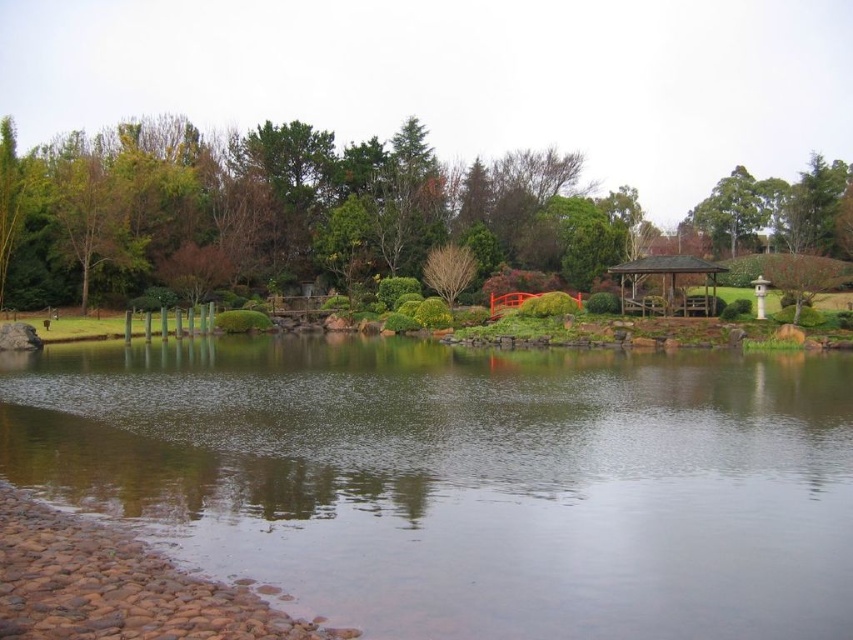
Does clear water at center lie in front of bare wood tree at center?

Yes.

Does clear water at center appear under bare wood tree at center?

Indeed, clear water at center is positioned under bare wood tree at center.

What do you see at coordinates (466, 480) in the screenshot? The image size is (853, 640). I see `clear water at center` at bounding box center [466, 480].

Locate an element on the screen. This screenshot has width=853, height=640. clear water at center is located at coordinates (466, 480).

Which is below, clear water at center or green leafy tree at upper center?

clear water at center is lower down.

Consider the image. Who is taller, clear water at center or green leafy tree at upper center?

green leafy tree at upper center is taller.

Which is behind, point (647, 563) or point (32, 285)?

Positioned behind is point (32, 285).

Locate an element on the screen. This screenshot has height=640, width=853. clear water at center is located at coordinates (466, 480).

Which is behind, point (718, 221) or point (695, 266)?

The point (718, 221) is more distant.

Is point (735, 225) farther from viewer compared to point (697, 260)?

Yes, it is behind point (697, 260).

What are the coordinates of `green leafy tree at upper right` in the screenshot? It's located at click(x=730, y=211).